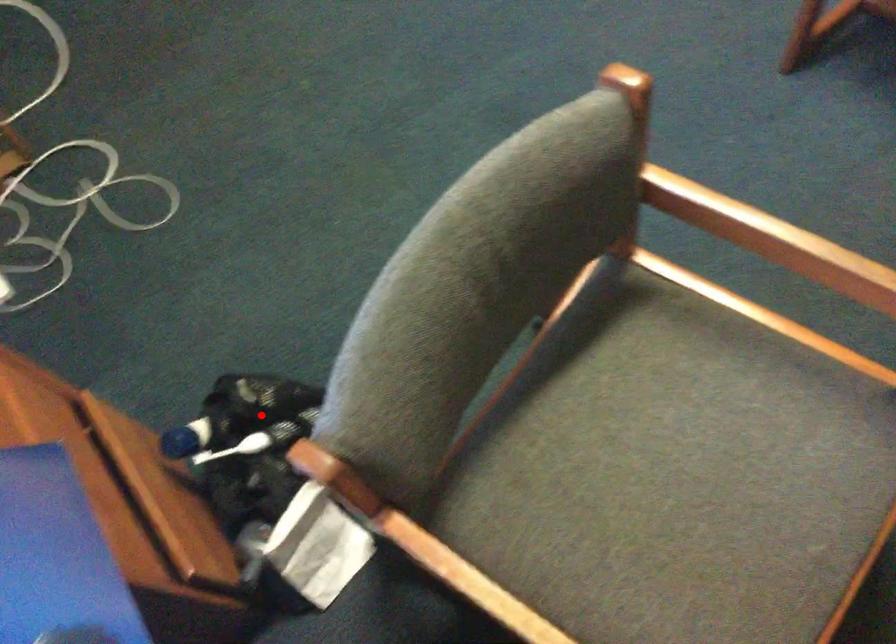
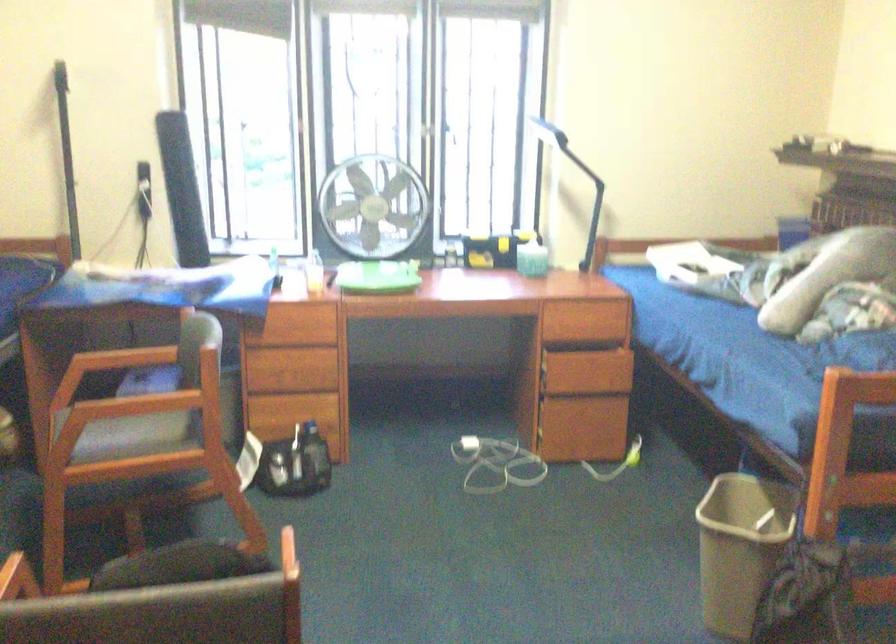
Question: I am providing you with two images of the same scene from different viewpoints. In image1, a red point is highlighted. Considering the same 3D point in image2, which of the following is correct?

Choices:
 (A) It is closer
 (B) It is farther

Answer: (B)